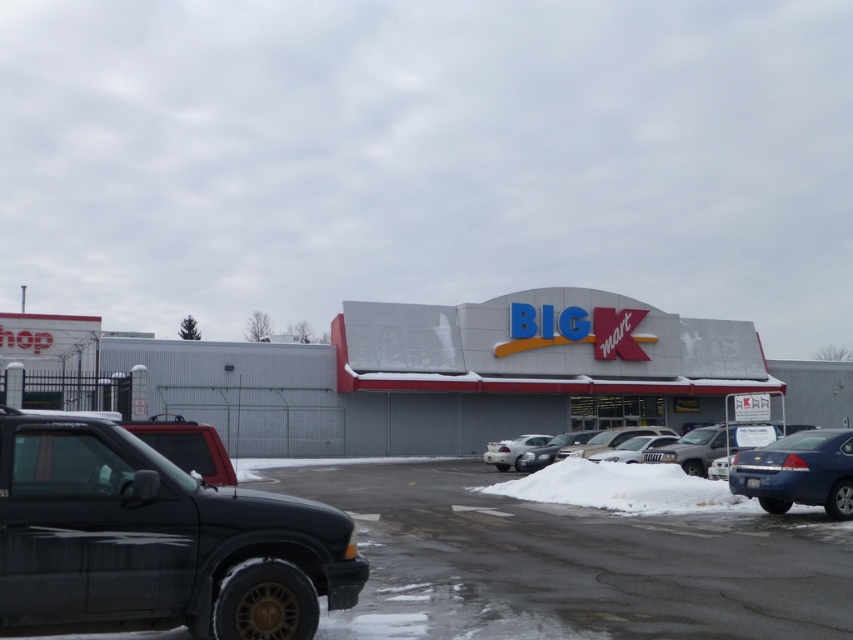
Measure the distance from snowy asphalt parking lot at lower left to matte blue sedan at lower right.

snowy asphalt parking lot at lower left is 2.45 meters from matte blue sedan at lower right.

Is snowy asphalt parking lot at lower left in front of matte blue sedan at lower right?

Yes.

Is point (633, 548) positioned before point (550, 468)?

Yes, point (633, 548) is in front of point (550, 468).

This screenshot has height=640, width=853. I want to click on snowy asphalt parking lot at lower left, so click(x=569, y=563).

Consider the image. Between metallic blue sedan at lower right and silver metallic sedan at center, which one is positioned higher?

Positioned higher is metallic blue sedan at lower right.

Does metallic blue sedan at lower right appear on the right side of silver metallic sedan at center?

Indeed, metallic blue sedan at lower right is positioned on the right side of silver metallic sedan at center.

Between point (755, 488) and point (517, 461), which one is positioned behind?

Positioned behind is point (517, 461).

Find the location of a particular element. metallic blue sedan at lower right is located at coordinates (798, 472).

Does matte black suv at left appear on the left side of satin silver sedan at center?

Correct, you'll find matte black suv at left to the left of satin silver sedan at center.

The height and width of the screenshot is (640, 853). What do you see at coordinates (155, 541) in the screenshot?
I see `matte black suv at left` at bounding box center [155, 541].

Does point (22, 433) lie behind point (619, 444)?

No, it is in front of (619, 444).

The height and width of the screenshot is (640, 853). I want to click on matte black suv at left, so pos(155,541).